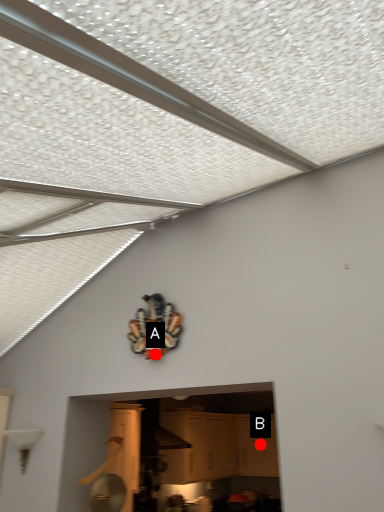
Question: Two points are circled on the image, labeled by A and B beside each circle. Which point appears closest to the camera in this image?

Choices:
 (A) A is closer
 (B) B is closer

Answer: (A)